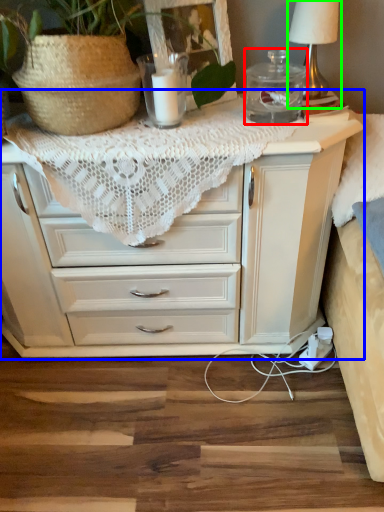
Question: Considering the real-world distances, which object is closest to glass jar (highlighted by a red box)? chest of drawers (highlighted by a blue box) or table lamp (highlighted by a green box).

Choices:
 (A) chest of drawers
 (B) table lamp

Answer: (B)